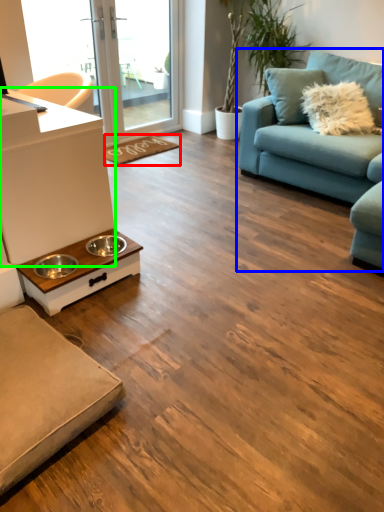
Question: Which object is positioned closest to doormat (highlighted by a red box)? Select from studio couch (highlighted by a blue box) and counter top (highlighted by a green box).

Choices:
 (A) studio couch
 (B) counter top

Answer: (A)